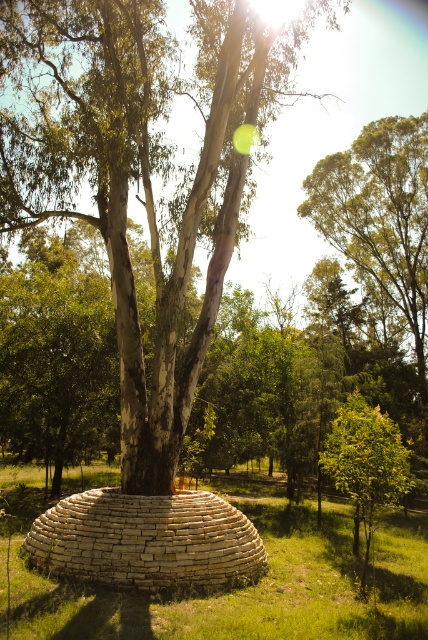
Question: Does smooth bark tree at center appear on the right side of white stone dome at center?

Choices:
 (A) yes
 (B) no

Answer: (B)

Question: Which point is farther to the camera?

Choices:
 (A) green leafy tree at center
 (B) white stone dome at center
 (C) smooth bark tree at center

Answer: (C)

Question: Which is farther from the white stone dome at center?

Choices:
 (A) green leafy tree at upper center
 (B) smooth bark tree at center

Answer: (A)

Question: Is green leafy tree at upper center to the left of green leafy tree at center from the viewer's perspective?

Choices:
 (A) no
 (B) yes

Answer: (A)

Question: Does smooth bark tree at center come behind white stone dome at center?

Choices:
 (A) no
 (B) yes

Answer: (B)

Question: Which of these objects is positioned closest to the smooth bark tree at center?

Choices:
 (A) green leafy tree at upper center
 (B) white stone dome at center

Answer: (B)